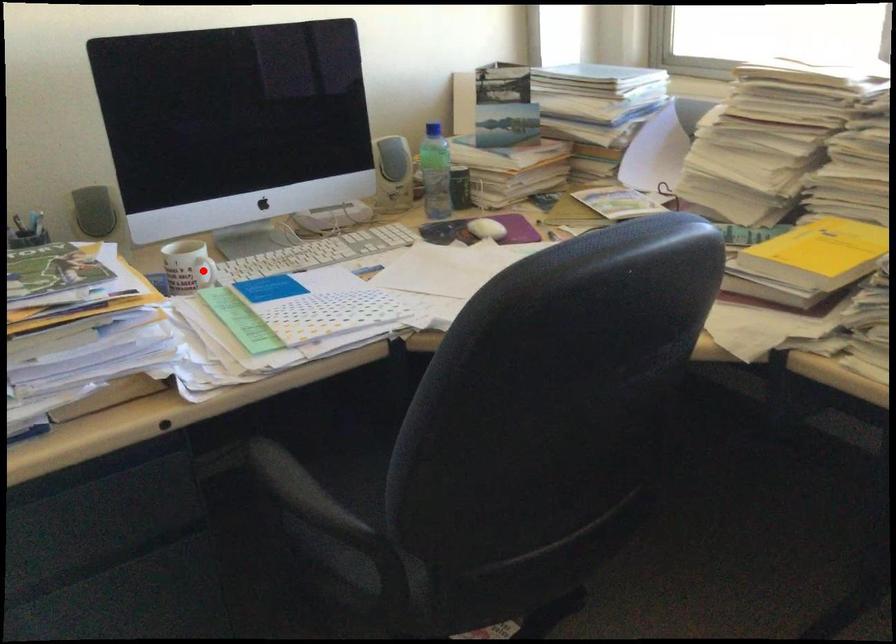
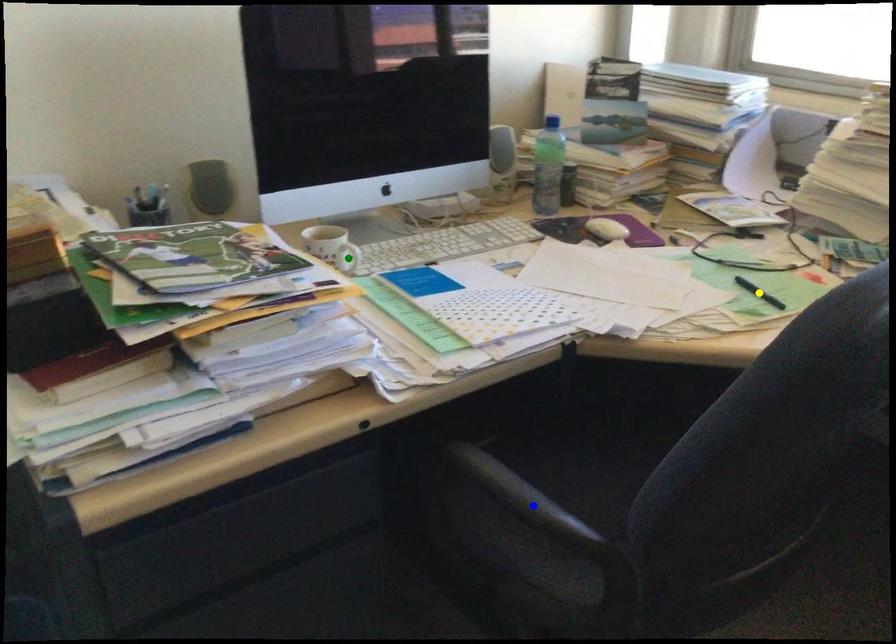
Question: I am providing you with two images of the same scene from different viewpoints. A red point is marked on the first image. You are given multiple points on the second image. Which point in image 2 represents the same 3d spot as the red point in image 1?

Choices:
 (A) blue point
 (B) yellow point
 (C) green point

Answer: (C)